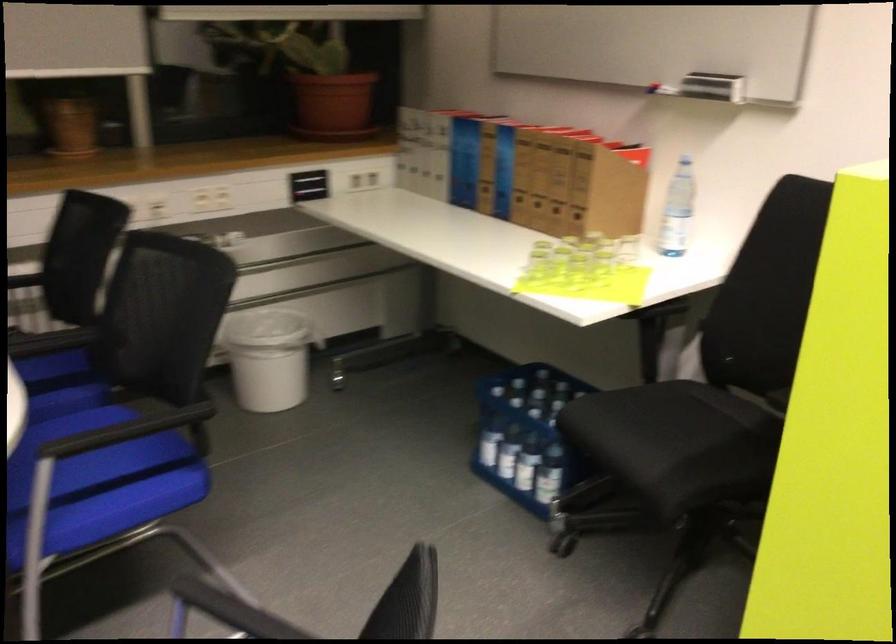
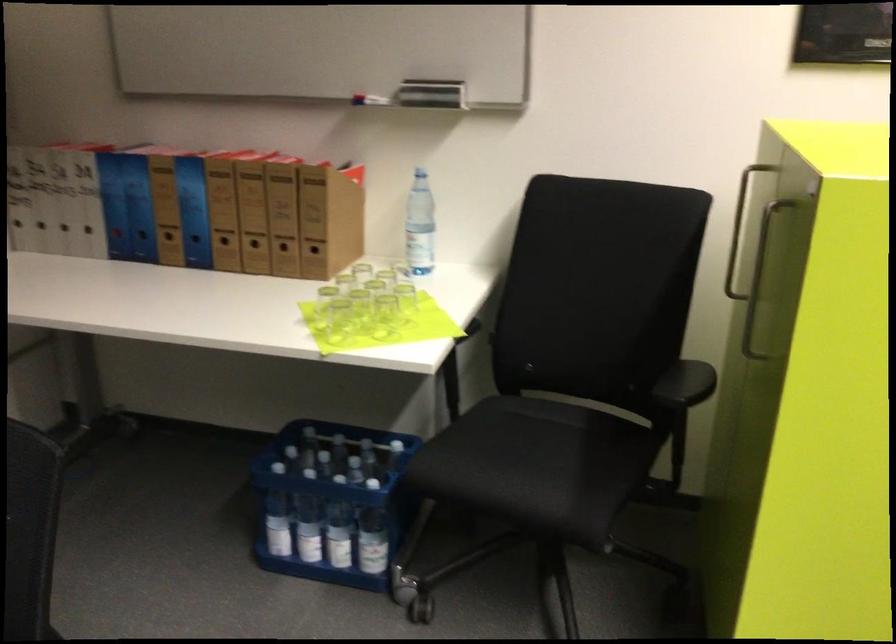
Find the pixel in the second image that matches the point at 554,214 in the first image.

(283, 252)